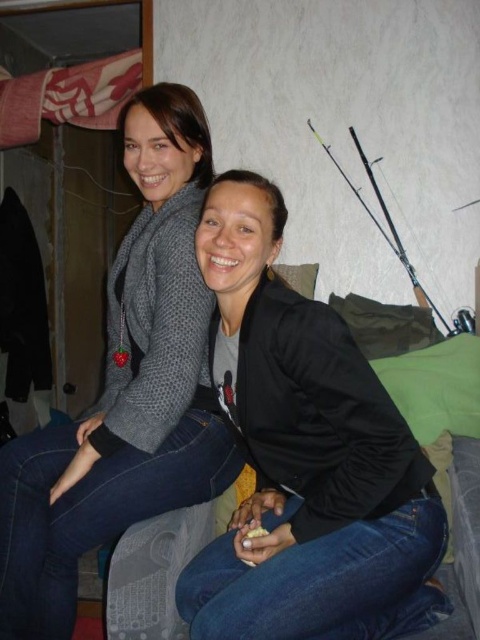
Question: Is black matte jacket at center behind knitted gray sweater at upper left?

Choices:
 (A) yes
 (B) no

Answer: (B)

Question: Which point is closer to the camera?

Choices:
 (A) knitted gray sweater at upper left
 (B) black matte jacket at center

Answer: (B)

Question: Does black matte jacket at center have a smaller size compared to knitted gray sweater at upper left?

Choices:
 (A) no
 (B) yes

Answer: (B)

Question: In this image, where is black matte jacket at center located relative to knitted gray sweater at upper left?

Choices:
 (A) below
 (B) above

Answer: (A)

Question: Which object appears closest to the camera in this image?

Choices:
 (A) knitted gray sweater at upper left
 (B) black matte jacket at center

Answer: (B)

Question: Which point is closer to the camera?

Choices:
 (A) black matte jacket at center
 (B) knitted gray sweater at upper left

Answer: (A)